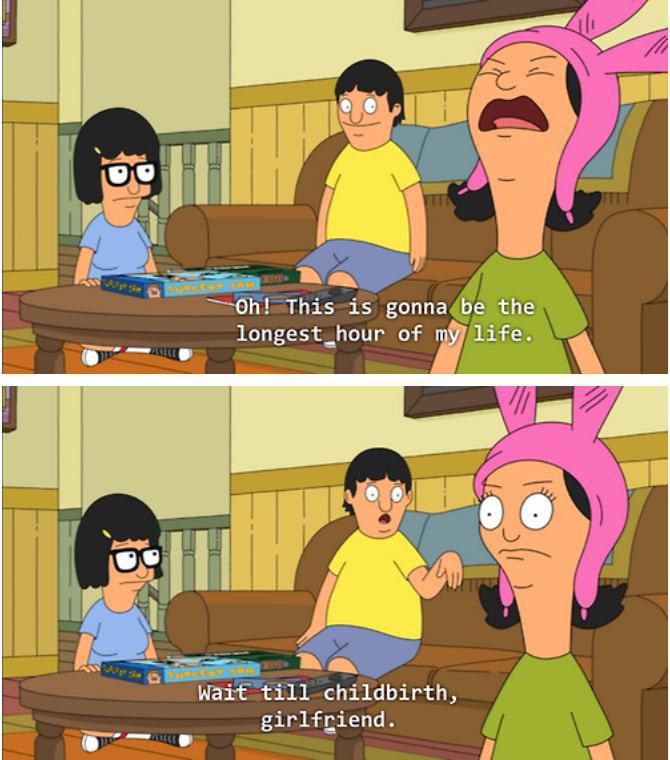
The image size is (670, 760). What are the coordinates of `armrest` in the screenshot? It's located at (232, 220), (644, 251), (618, 670), (232, 619).